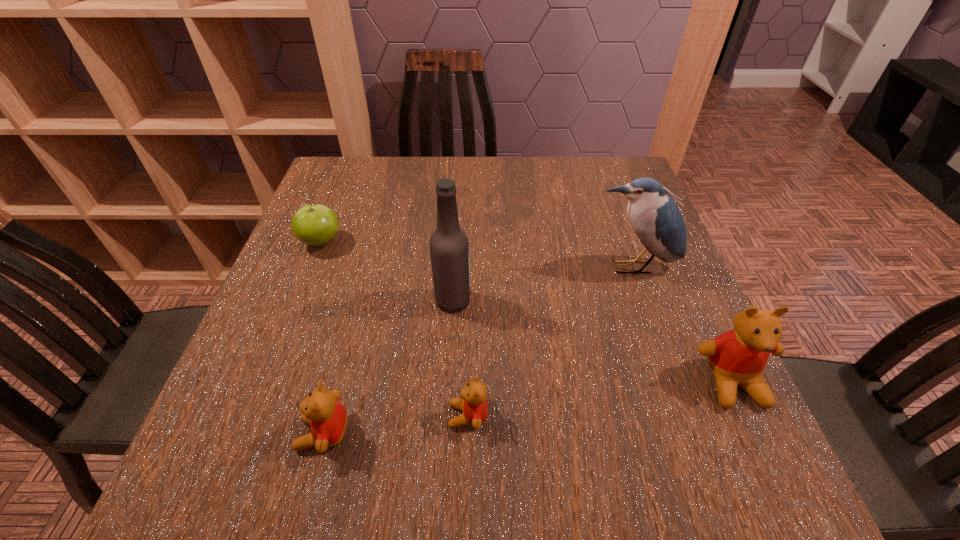
What are the coordinates of `bird present at the right edge` in the screenshot? It's located at (654, 216).

Identify the location of object at the near left corner. (327, 417).

Find the location of a particular element. The width and height of the screenshot is (960, 540). object present at the near right corner is located at coordinates (738, 357).

The height and width of the screenshot is (540, 960). Identify the location of vacant space at the far edge. (516, 162).

What are the coordinates of `free space at the near edge of the desktop` in the screenshot? It's located at (591, 421).

Identify the location of free space at the left edge of the desktop. The width and height of the screenshot is (960, 540). (247, 343).

Find the location of `vacant area at the right edge of the desktop`. vacant area at the right edge of the desktop is located at coordinates (705, 363).

The image size is (960, 540). Identify the location of vacant space at the far left corner. (369, 192).

You are a GUI agent. You are given a task and a screenshot of the screen. Output one action in this format:
    pyautogui.click(x=<x>, y=<y>)
    Task: Click on the empty location between the leftmost teddy bear and the bird
    
    Given the screenshot: What is the action you would take?
    pyautogui.click(x=478, y=350)

At what (x,y) coordinates should I click in order to perform the action: click on vacant space that is in between the bird and the third farthest object. Please return your answer as a coordinate pair (x, y). Image resolution: width=960 pixels, height=540 pixels. Looking at the image, I should click on (542, 284).